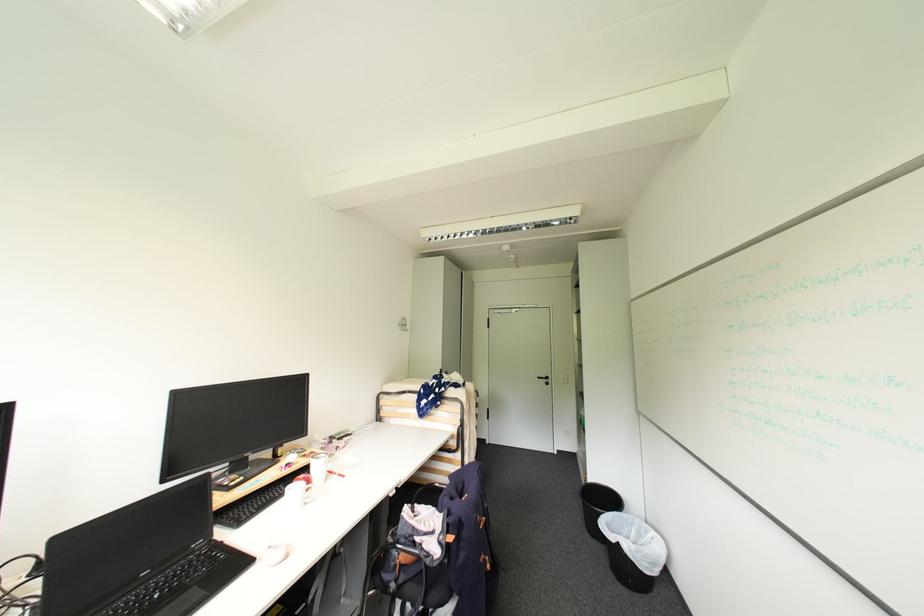
The width and height of the screenshot is (924, 616). Describe the element at coordinates (403, 323) in the screenshot. I see `a white wall hook` at that location.